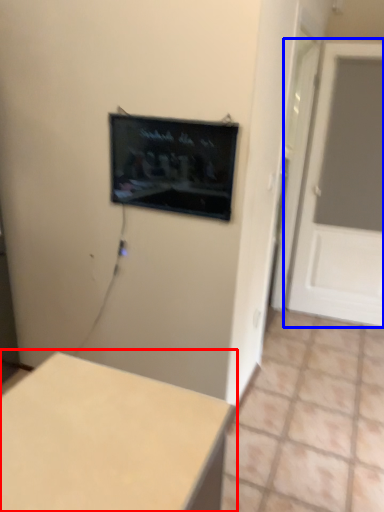
Question: Which object appears farthest to the camera in this image, table (highlighted by a red box) or door (highlighted by a blue box)?

Choices:
 (A) table
 (B) door

Answer: (B)